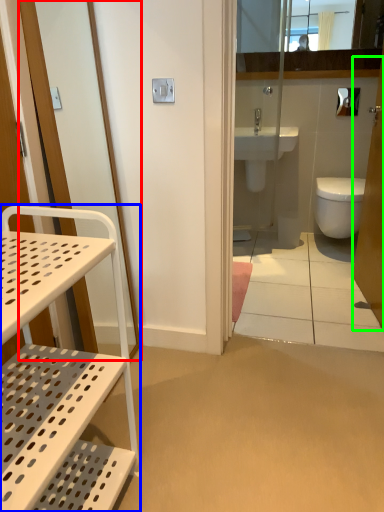
Question: Based on their relative distances, which object is nearer to screen door (highlighted by a red box)? Choose from furniture (highlighted by a blue box) and screen door (highlighted by a green box).

Choices:
 (A) furniture
 (B) screen door

Answer: (A)